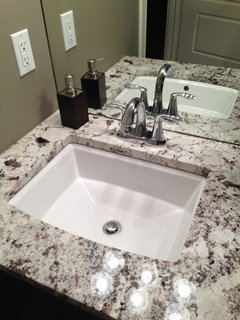
You are a GUI agent. You are given a task and a screenshot of the screen. Output one action in this format:
    pyautogui.click(x=<x>, y=<y>)
    Task: Click on the brown wall
    
    Given the screenshot: What is the action you would take?
    pyautogui.click(x=21, y=110)